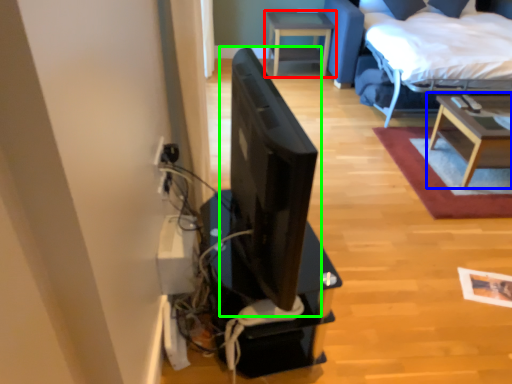
Question: Which is farther away from table (highlighted by a red box)? table (highlighted by a blue box) or computer monitor (highlighted by a green box)?

Choices:
 (A) table
 (B) computer monitor

Answer: (B)